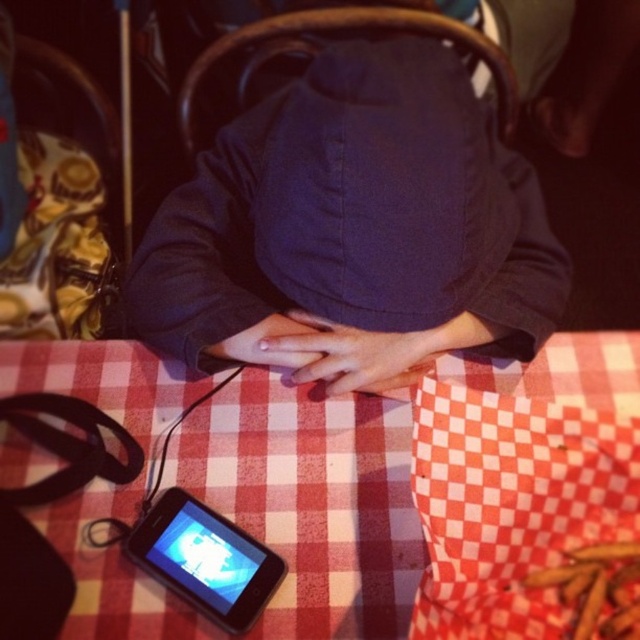
How much distance is there between dark blue fabric at center and black glossy ipod at lower left?

dark blue fabric at center is 10.53 inches away from black glossy ipod at lower left.

Which of these two, dark blue fabric at center or black glossy ipod at lower left, stands shorter?

black glossy ipod at lower left is shorter.

Does point (369, 172) come closer to viewer compared to point (250, 602)?

Yes, it is in front of point (250, 602).

At what (x,y) coordinates should I click in order to perform the action: click on dark blue fabric at center. Please return your answer as a coordinate pair (x, y). This screenshot has height=640, width=640. Looking at the image, I should click on (353, 228).